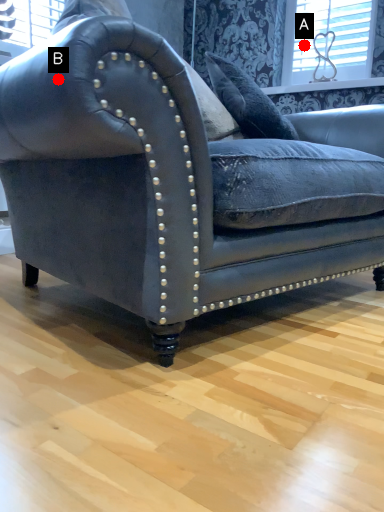
Question: Two points are circled on the image, labeled by A and B beside each circle. Which point is closer to the camera?

Choices:
 (A) A is closer
 (B) B is closer

Answer: (B)